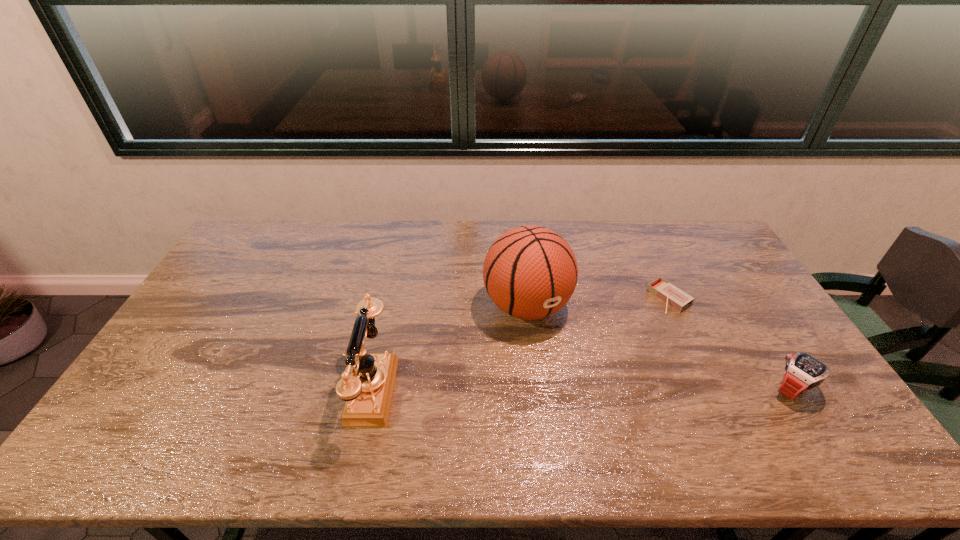
The image size is (960, 540). What are the coordinates of `telephone` in the screenshot? It's located at (367, 384).

Locate an element on the screen. This screenshot has width=960, height=540. the second tallest object is located at coordinates (367, 384).

Find the location of a particular element. the second shortest object is located at coordinates coord(802,372).

Where is `watch`? This screenshot has width=960, height=540. watch is located at coordinates (802, 372).

Identify the location of the third object from right to left. (530, 272).

Image resolution: width=960 pixels, height=540 pixels. I want to click on the tallest object, so click(x=530, y=272).

The width and height of the screenshot is (960, 540). I want to click on matchbox, so click(x=662, y=289).

You are a GUI agent. You are given a task and a screenshot of the screen. Output one action in this format:
    pyautogui.click(x=<x>, y=<y>)
    Task: Click on the third object from left to right
    Image resolution: width=960 pixels, height=540 pixels.
    Given the screenshot: What is the action you would take?
    pyautogui.click(x=662, y=289)

Locate an element on the screen. This screenshot has height=540, width=960. vacant region located on the dial of the second tallest object is located at coordinates (275, 389).

Where is `free space located on the dial of the second tallest object`? The image size is (960, 540). free space located on the dial of the second tallest object is located at coordinates (282, 389).